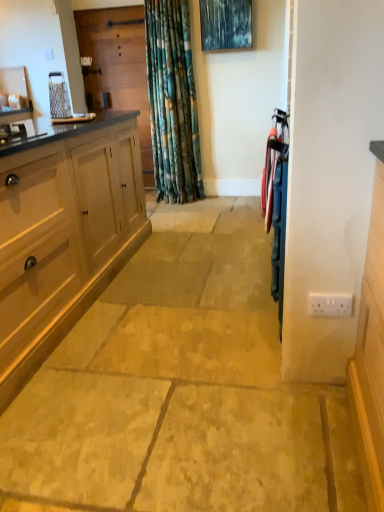
In order to click on free point above wooden screen door at upper left, which is the 1th screen door in back-to-front order (from a real-world perspective) in this screenshot , I will do `click(104, 9)`.